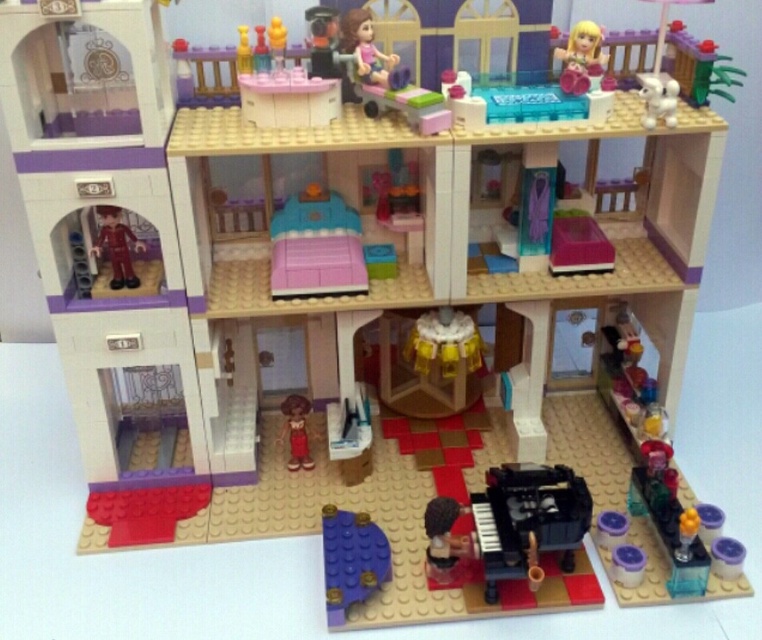
Which of these two, purple matte plate at lower center or matte brown doll at center, stands shorter?

matte brown doll at center is shorter.

Does purple matte plate at lower center come in front of matte brown doll at center?

Yes, purple matte plate at lower center is closer to the viewer.

What do you see at coordinates (351, 560) in the screenshot? I see `purple matte plate at lower center` at bounding box center [351, 560].

I want to click on purple matte plate at lower center, so click(x=351, y=560).

Is point (376, 579) farther from camera compared to point (357, 72)?

That is False.

Who is lower down, purple matte plate at lower center or matte pink dress at upper center?

Positioned lower is purple matte plate at lower center.

Does point (378, 564) come closer to viewer compared to point (375, 83)?

Yes.

You are a GUI agent. You are given a task and a screenshot of the screen. Output one action in this format:
    pyautogui.click(x=<x>, y=<y>)
    Task: Click on the purple matte plate at lower center
    
    Given the screenshot: What is the action you would take?
    pyautogui.click(x=351, y=560)

Does shiny red suit at left have a greater width compared to translucent blue plastic vase at upper center?

Indeed, shiny red suit at left has a greater width compared to translucent blue plastic vase at upper center.

Does shiny red suit at left have a smaller size compared to translucent blue plastic vase at upper center?

No, shiny red suit at left is not smaller than translucent blue plastic vase at upper center.

Identify the location of shiny red suit at left. This screenshot has width=762, height=640. (117, 246).